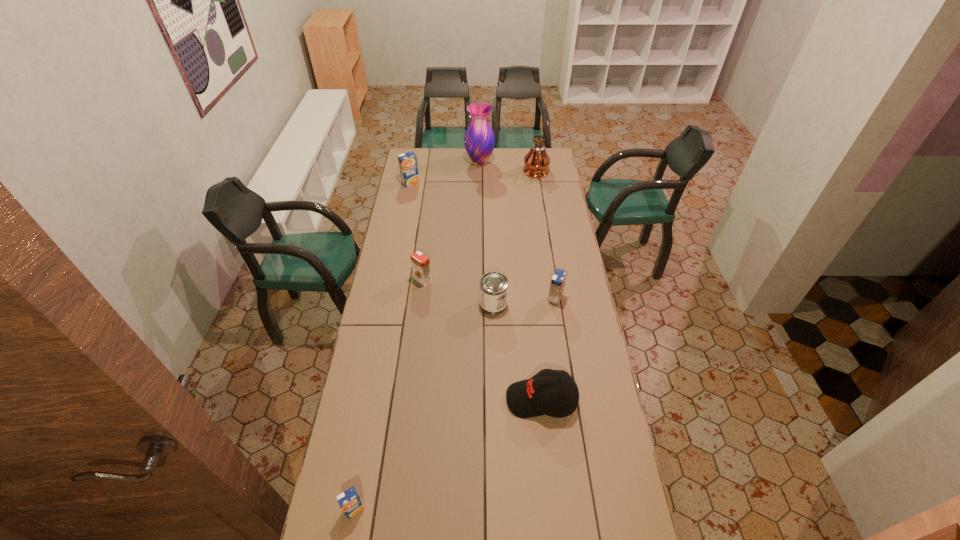
You are a GUI agent. You are given a task and a screenshot of the screen. Output one action in this format:
    pyautogui.click(x=<x>, y=<y>)
    Task: Click on the free space at the far edge of the desktop
    
    Given the screenshot: What is the action you would take?
    pyautogui.click(x=455, y=158)

Identify the location of free region at the left edge of the desktop. (406, 256).

Image resolution: width=960 pixels, height=540 pixels. Find the location of `vacant space at the right edge`. vacant space at the right edge is located at coordinates (569, 431).

Find the location of `unoccupied position between the baseball cap and the can`. unoccupied position between the baseball cap and the can is located at coordinates (517, 352).

The image size is (960, 540). I want to click on free spot between the purple vase and the third nearest orange_juice, so click(x=451, y=221).

At what (x,y) coordinates should I click in order to perform the action: click on free space between the can and the vase. Please return your answer as a coordinate pair (x, y). Looking at the image, I should click on point(487,233).

Locate an element on the screen. vacant area that lies between the oil lamp and the third tallest object is located at coordinates pyautogui.click(x=473, y=178).

You are a GUI agent. You are given a task and a screenshot of the screen. Output one action in this format:
    pyautogui.click(x=<x>, y=<y>)
    Task: Click on the vacant space that's between the oil lamp and the farthest blue orange_juice
    Image resolution: width=960 pixels, height=540 pixels.
    Given the screenshot: What is the action you would take?
    pyautogui.click(x=473, y=178)

Where is `free space between the oil lamp and the purple vase`? Image resolution: width=960 pixels, height=540 pixels. free space between the oil lamp and the purple vase is located at coordinates (508, 168).

Where is `vacant region between the third object from left to right and the vase`? The width and height of the screenshot is (960, 540). vacant region between the third object from left to right and the vase is located at coordinates (451, 221).